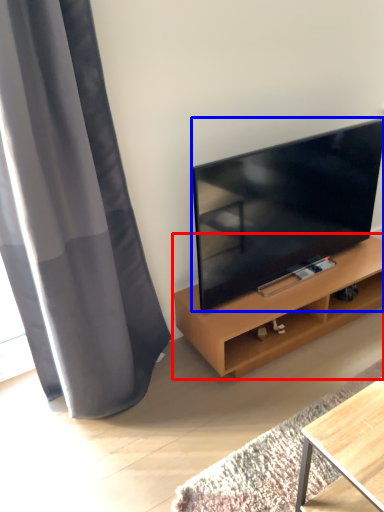
Question: Which of the following is the farthest to the observer, shelf (highlighted by a red box) or television (highlighted by a blue box)?

Choices:
 (A) shelf
 (B) television

Answer: (A)